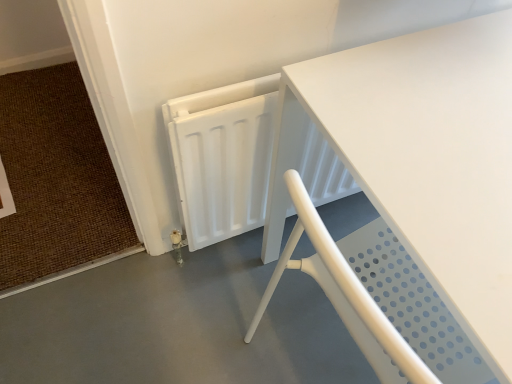
Question: Is brown woven mat at lower left a part of white matte table at center?

Choices:
 (A) no
 (B) yes

Answer: (A)

Question: From a real-world perspective, is white matte table at center beneath brown woven mat at lower left?

Choices:
 (A) no
 (B) yes

Answer: (A)

Question: Does white matte table at center come behind brown woven mat at lower left?

Choices:
 (A) yes
 (B) no

Answer: (B)

Question: Can you confirm if white matte table at center is smaller than brown woven mat at lower left?

Choices:
 (A) no
 (B) yes

Answer: (A)

Question: From the image's perspective, is white matte table at center below brown woven mat at lower left?

Choices:
 (A) no
 (B) yes

Answer: (B)

Question: Is white matte table at center oriented towards brown woven mat at lower left?

Choices:
 (A) yes
 (B) no

Answer: (B)

Question: Does brown woven mat at lower left touch white matte table at center?

Choices:
 (A) yes
 (B) no

Answer: (B)

Question: Considering the relative positions of brown woven mat at lower left and white matte table at center in the image provided, is brown woven mat at lower left to the left of white matte table at center from the viewer's perspective?

Choices:
 (A) yes
 (B) no

Answer: (A)

Question: Is brown woven mat at lower left looking in the opposite direction of white matte table at center?

Choices:
 (A) no
 (B) yes

Answer: (A)

Question: Would you say brown woven mat at lower left is outside white matte table at center?

Choices:
 (A) yes
 (B) no

Answer: (A)

Question: From a real-world perspective, is brown woven mat at lower left located beneath white matte table at center?

Choices:
 (A) yes
 (B) no

Answer: (A)

Question: Considering the relative sizes of brown woven mat at lower left and white matte table at center in the image provided, is brown woven mat at lower left taller than white matte table at center?

Choices:
 (A) yes
 (B) no

Answer: (B)

Question: Is white matte table at center facing away from white perforated chair at lower right?

Choices:
 (A) no
 (B) yes

Answer: (A)